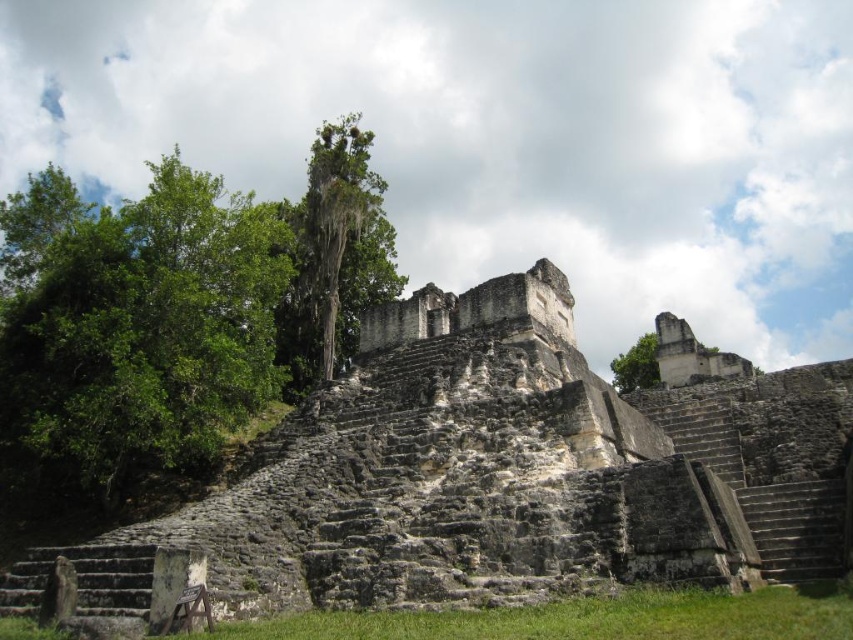
You are standing at the center of the image and want to locate the green leafy tree at left. In which direction should you look to find it?

The green leafy tree at left is located at the lower left area of the image, so you should look to your left and slightly downward to find it.

You are a visitor standing at the base of the ancient stone structure. You notice two trees in the scene. The green mossy tree at center and the green leafy tree at upper right. Which tree is farther away from you?

The green leafy tree at upper right is farther away from you because it is 75.99 meters away from the green mossy tree at center, which is closer to the structure.

You are standing at the base of the ancient stone structure and want to determine which of the two points, point (210, 232) or point (331, 225), is closer to you. Based on the image, which point is nearer?

Point (210, 232) is closer to the viewer than point (331, 225).